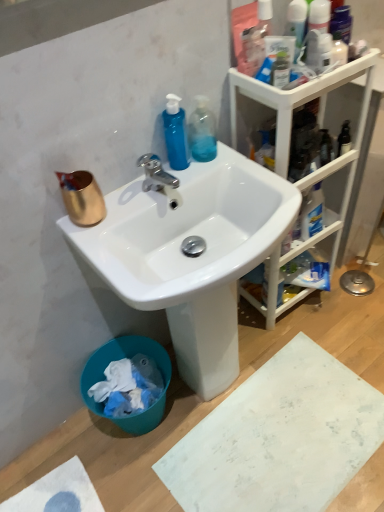
The width and height of the screenshot is (384, 512). I want to click on free location to the right of transparent plastic bottle at upper center, placed as the 1th cleaning product when sorted from right to left, so click(233, 158).